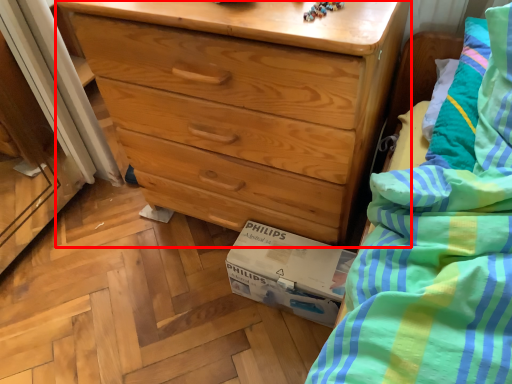
Question: From the image's perspective, where is chest of drawers (annotated by the red box) located in relation to cardboard box in the image?

Choices:
 (A) below
 (B) above

Answer: (B)